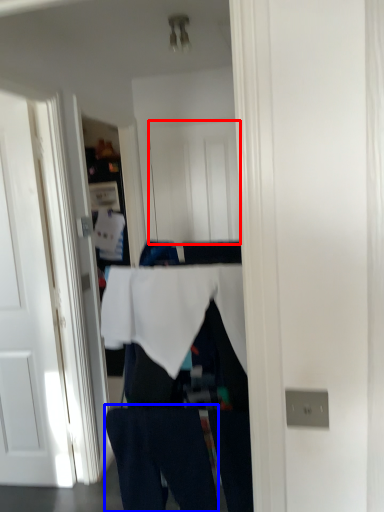
Question: Which object appears farthest to the camera in this image, door (highlighted by a red box) or jeans (highlighted by a blue box)?

Choices:
 (A) door
 (B) jeans

Answer: (A)